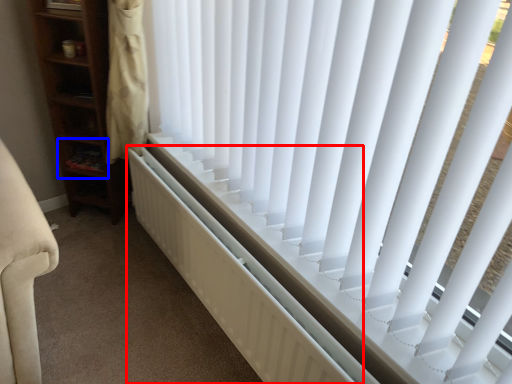
Question: Which object is further to the camera taking this photo, radiator (highlighted by a red box) or shelf (highlighted by a blue box)?

Choices:
 (A) radiator
 (B) shelf

Answer: (B)